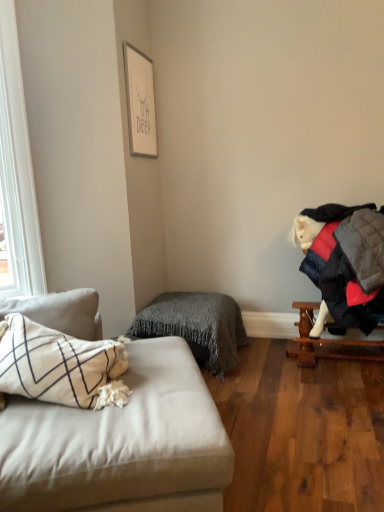
Question: From their relative heights in the image, would you say white matte picture frame at upper center is taller or shorter than light gray fabric studio couch at left?

Choices:
 (A) tall
 (B) short

Answer: (B)

Question: Which is correct: white matte picture frame at upper center is inside light gray fabric studio couch at left, or outside of it?

Choices:
 (A) inside
 (B) outside

Answer: (B)

Question: Based on their relative distances, which object is farther from the wooden table at right?

Choices:
 (A) gray fuzzy blanket at center
 (B) light gray fabric studio couch at left
 (C) white matte picture frame at upper center

Answer: (C)

Question: Estimate the real-world distances between objects in this image. Which object is closer to the gray fuzzy blanket at center?

Choices:
 (A) wooden table at right
 (B) light gray fabric studio couch at left
 (C) white matte picture frame at upper center

Answer: (A)